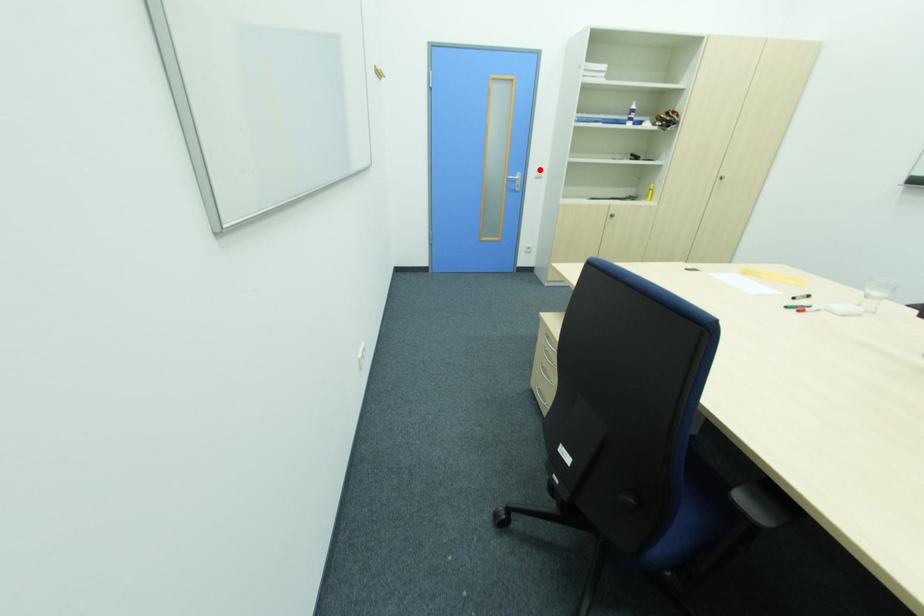
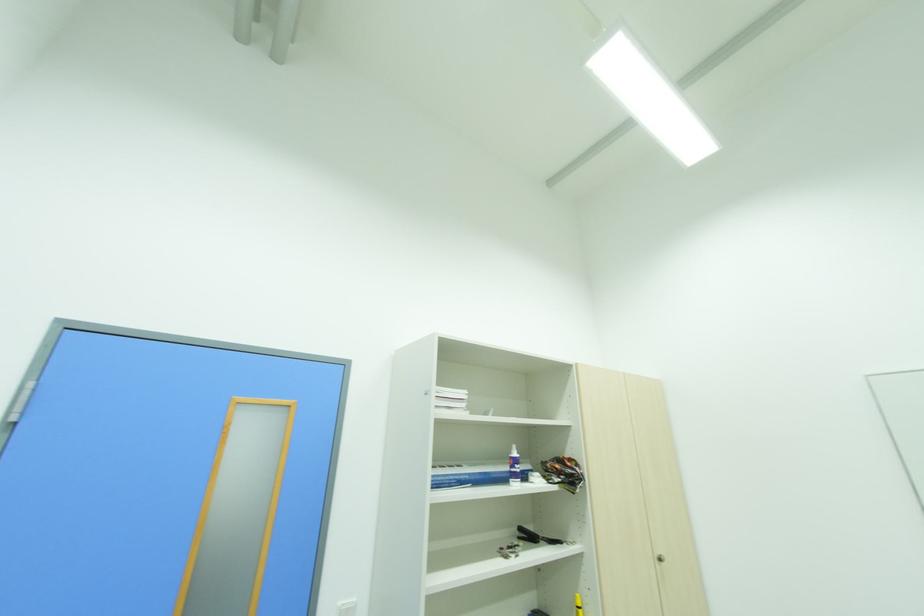
Locate, in the second image, the point that corresponds to the highlighted location in the first image.

(344, 604)